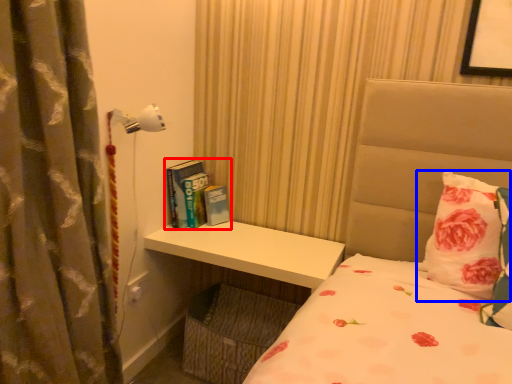
Question: Which object is further to the camera taking this photo, book (highlighted by a red box) or pillow (highlighted by a blue box)?

Choices:
 (A) book
 (B) pillow

Answer: (A)